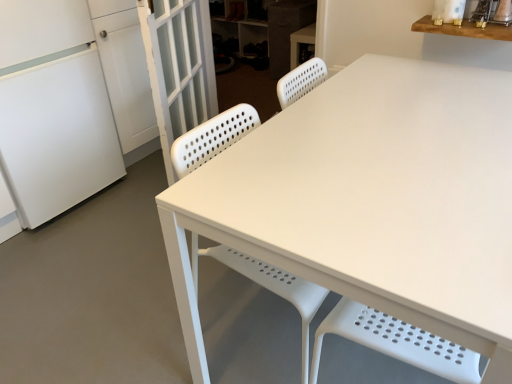
Identify the location of free space that is to the left of white perforated plastic chair at center. The image size is (512, 384). (155, 326).